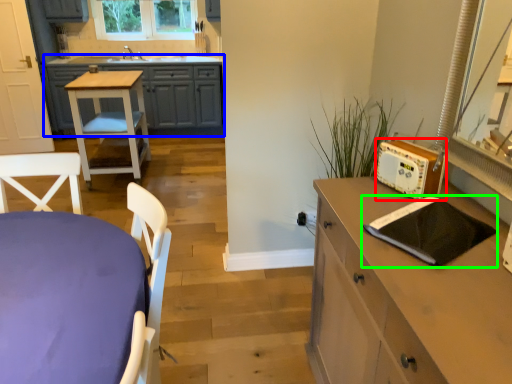
Question: Estimate the real-world distances between objects in this image. Which object is farther from appliance (highlighted by a red box), cabinetry (highlighted by a blue box) or pad (highlighted by a green box)?

Choices:
 (A) cabinetry
 (B) pad

Answer: (A)